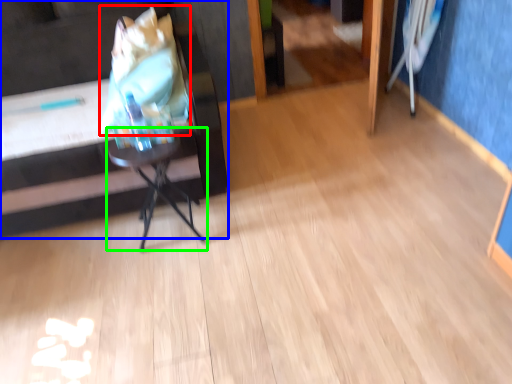
Question: Which object is the farthest from grocery bag (highlighted by a red box)? Choose among these: furniture (highlighted by a blue box) or table (highlighted by a green box).

Choices:
 (A) furniture
 (B) table

Answer: (B)